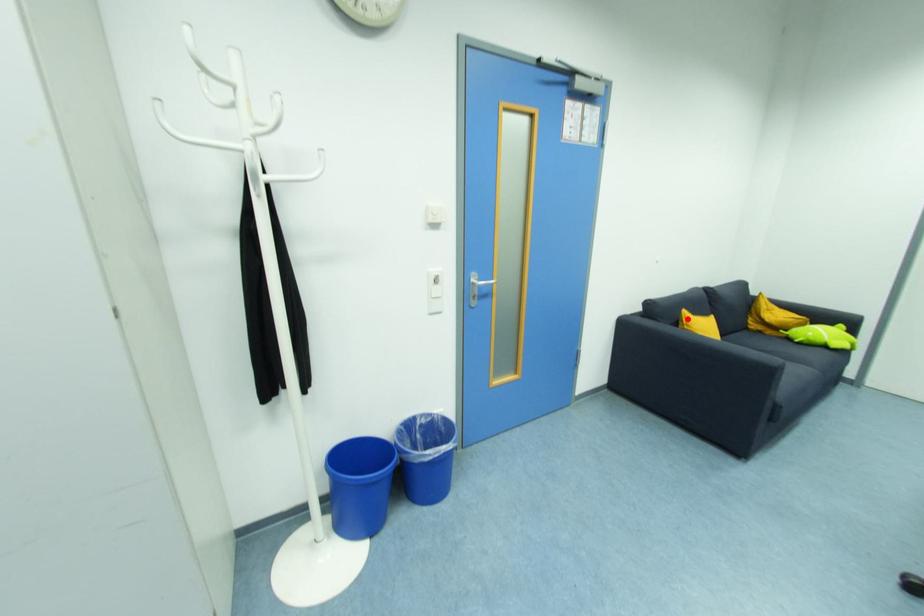
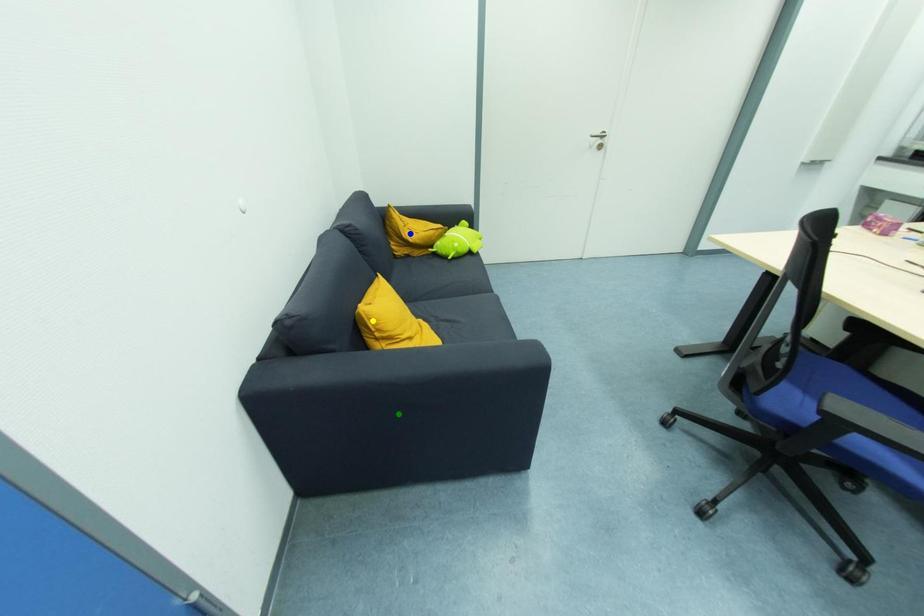
Question: I am providing you with two images of the same scene from different viewpoints. A red point is marked on the first image. You are given multiple points on the second image. Which point in image 2 is actually the same real-world point as the red point in image 1?

Choices:
 (A) green point
 (B) yellow point
 (C) blue point

Answer: (B)